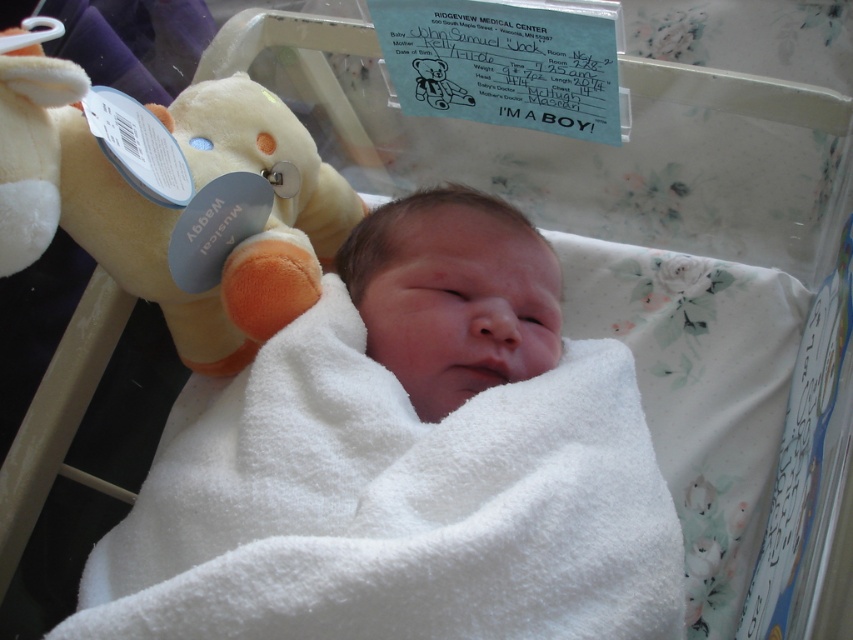
You are a nurse in a hospital nursery. You need to determine which object is bigger between the fluffy white plush bear at left and the white soft blanket at center. Which one is larger?

The fluffy white plush bear at left is larger in size compared to the white soft blanket at center according to the description.

You are a nurse checking the bassinet. The fluffy white plush bear at left and the white soft blanket at center are both in the bassinet. Which object is wider?

The fluffy white plush bear at left is wider than the white soft blanket at center.

You are a nurse in the hospital nursery. You need to place the fluffy white plush bear at left and the white soft blanket at center into a storage bin. The bin has a height limit of 30 cm. Can both items fit vertically inside the bin without exceeding the height limit?

The fluffy white plush bear at left is much taller than the white soft blanket at center. Since the bear exceeds the 30 cm height limit, it cannot fit vertically in the bin. The blanket may fit, but the bear cannot.